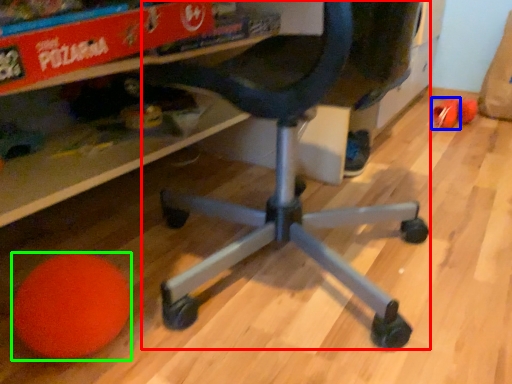
Question: Which object is positioned closest to computer chair (highlighted by a red box)? Select from toy (highlighted by a blue box) and ball (highlighted by a green box).

Choices:
 (A) toy
 (B) ball

Answer: (B)